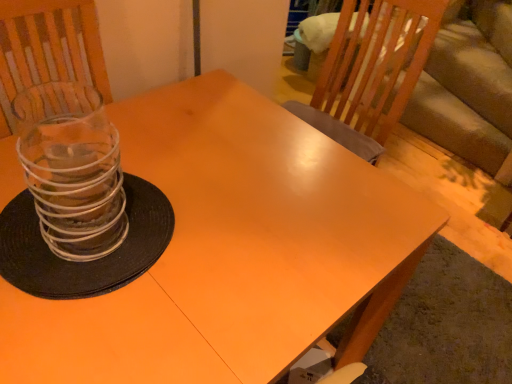
The image size is (512, 384). Find the location of `free space above matte orange table at center (from a real-world perspective)`. free space above matte orange table at center (from a real-world perspective) is located at coordinates (136, 263).